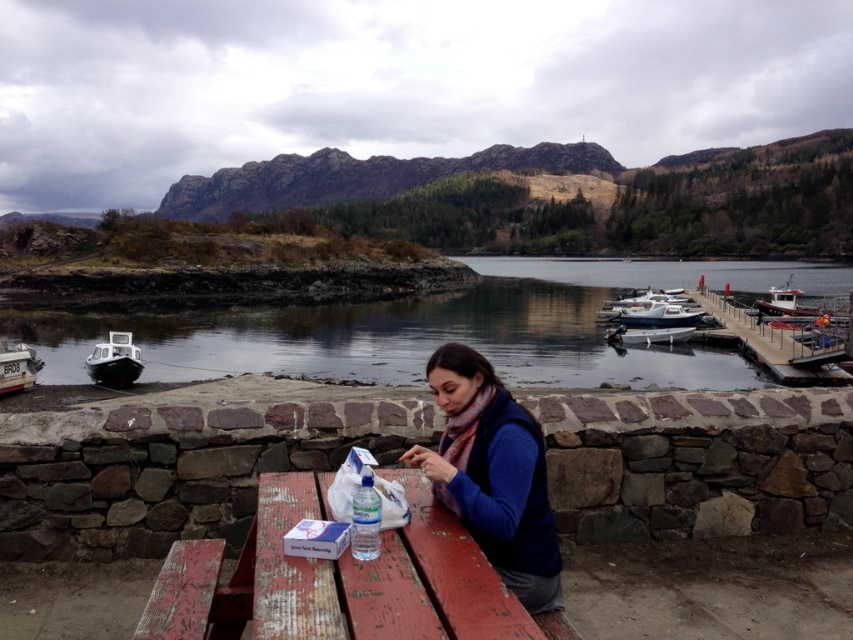
Is rusty wood table at center above white plastic boat at left?

Correct, rusty wood table at center is located above white plastic boat at left.

Is rusty wood table at center in front of white plastic boat at left?

Yes, it is in front of white plastic boat at left.

Where is `rusty wood table at center`? rusty wood table at center is located at coordinates (376, 576).

Identify the location of smooth wooden dock at right. (780, 342).

Does smooth wooden dock at right have a lesser height compared to white glossy boat at center?

No, smooth wooden dock at right is not shorter than white glossy boat at center.

Which is in front, point (791, 324) or point (683, 330)?

Point (683, 330) is in front.

This screenshot has height=640, width=853. What are the coordinates of `smooth wooden dock at right` in the screenshot? It's located at (780, 342).

From the picture: Which of these two, clear water at dock center or white glossy boat at left, stands shorter?

With less height is white glossy boat at left.

Who is more distant from viewer, [374,358] or [113,346]?

The point [374,358] is more distant.

Between point (451, 310) and point (126, 349), which one is positioned behind?

The point (451, 310) is more distant.

Find the location of a particular element. Image resolution: width=853 pixels, height=640 pixels. clear water at dock center is located at coordinates (432, 328).